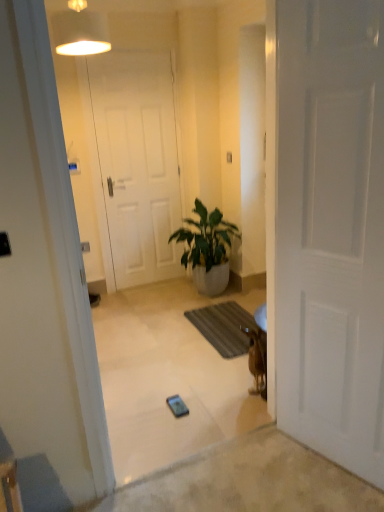
Where is `brown textured mat at lower center`? The width and height of the screenshot is (384, 512). brown textured mat at lower center is located at coordinates (224, 327).

This screenshot has height=512, width=384. Describe the element at coordinates (207, 249) in the screenshot. I see `green glossy plant at center` at that location.

Locate an element on the screen. metallic silver phone at center is located at coordinates (177, 406).

This screenshot has height=512, width=384. What are the coordinates of `brown furry dog at right` in the screenshot? It's located at (257, 359).

What do you see at coordinates (137, 163) in the screenshot? The height and width of the screenshot is (512, 384). I see `white matte door at center, which ranks as the first door in left-to-right order` at bounding box center [137, 163].

Where is `white matte door at center, placed as the second door when sorted from back to front`? white matte door at center, placed as the second door when sorted from back to front is located at coordinates (331, 229).

From a real-world perspective, is brown furry dog at right positioned under green glossy plant at center based on gravity?

Yes, from a real-world perspective, brown furry dog at right is below green glossy plant at center.

This screenshot has height=512, width=384. What are the coordinates of `animal in front of the green glossy plant at center` in the screenshot? It's located at (257, 359).

Which is further, (261, 366) or (229, 224)?

The point (229, 224) is behind.

Is green glossy plant at center at the back of brown furry dog at right?

No.

Considering the relative sizes of white fabric lampshade at upper center and metallic silver phone at center in the image provided, is white fabric lampshade at upper center thinner than metallic silver phone at center?

No.

How different are the orientations of white fabric lampshade at upper center and metallic silver phone at center in degrees?

The angular difference between white fabric lampshade at upper center and metallic silver phone at center is 2.1 degrees.

Where is `lamp that appears above the metallic silver phone at center (from the image's perspective)`? This screenshot has height=512, width=384. lamp that appears above the metallic silver phone at center (from the image's perspective) is located at coordinates (80, 31).

From their relative heights in the image, would you say white fabric lampshade at upper center is taller or shorter than metallic silver phone at center?

white fabric lampshade at upper center is taller than metallic silver phone at center.

Are green glossy plant at center and metallic silver phone at center far apart?

Yes, green glossy plant at center is far from metallic silver phone at center.

Is point (182, 240) more distant than point (184, 406)?

Yes, point (182, 240) is behind point (184, 406).

Which of these two, green glossy plant at center or metallic silver phone at center, is bigger?

green glossy plant at center is bigger.

Is green glossy plant at center to the left or to the right of metallic silver phone at center in the image?

In the image, green glossy plant at center appears on the right side of metallic silver phone at center.

From a real-world perspective, is metallic silver phone at center physically located above or below brown furry dog at right?

From a real-world perspective, metallic silver phone at center is physically below brown furry dog at right.

Is metallic silver phone at center far away from brown furry dog at right?

No, there isn't a large distance between metallic silver phone at center and brown furry dog at right.

Between point (171, 402) and point (260, 388), which one is positioned behind?

The point (260, 388) is more distant.

From the image's perspective, would you say metallic silver phone at center is positioned over brown furry dog at right?

No, from the image's perspective, metallic silver phone at center is not on top of brown furry dog at right.

Is white fabric lampshade at upper center facing away from brown furry dog at right?

No, white fabric lampshade at upper center is not facing the opposite direction of brown furry dog at right.

Is white fabric lampshade at upper center situated inside brown furry dog at right or outside?

white fabric lampshade at upper center is not inside brown furry dog at right, it's outside.

From the image's perspective, between white fabric lampshade at upper center and brown furry dog at right, who is located below?

brown furry dog at right.

Is point (82, 24) positioned before point (264, 351)?

Yes, point (82, 24) is in front of point (264, 351).

Can you confirm if white matte door at center, the 1th door positioned from the right, is positioned to the right of brown textured mat at lower center?

Yes.

What's the angular difference between white matte door at center, which is the 2th door in left-to-right order, and brown textured mat at lower center's facing directions?

The angle between the facing direction of white matte door at center, which is the 2th door in left-to-right order, and the facing direction of brown textured mat at lower center is 21.5 degrees.

Which is in front, point (304, 71) or point (220, 309)?

The point (304, 71) is closer to the camera.

From a real-world perspective, is white matte door at center, the 1th door positioned from the right, above or below brown textured mat at lower center?

white matte door at center, the 1th door positioned from the right, is situated higher than brown textured mat at lower center in the real world.

Considering the sizes of objects metallic silver phone at center and white fabric lampshade at upper center in the image provided, who is shorter, metallic silver phone at center or white fabric lampshade at upper center?

With less height is metallic silver phone at center.

Where is `lamp above the metallic silver phone at center (from the image's perspective)`? The width and height of the screenshot is (384, 512). lamp above the metallic silver phone at center (from the image's perspective) is located at coordinates (80, 31).

Between metallic silver phone at center and white fabric lampshade at upper center, which one has smaller size?

Smaller between the two is metallic silver phone at center.

Is metallic silver phone at center wider than white fabric lampshade at upper center?

Incorrect, the width of metallic silver phone at center does not surpass that of white fabric lampshade at upper center.

Identify the location of animal on the right side of green glossy plant at center. This screenshot has width=384, height=512. [x=257, y=359].

The height and width of the screenshot is (512, 384). Identify the location of lamp above the metallic silver phone at center (from the image's perspective). (80, 31).

Based on their spatial positions, is white matte door at center, which is the 2th door in left-to-right order, or brown furry dog at right further from white matte door at center, the second door positioned from the right?

white matte door at center, which is the 2th door in left-to-right order, is positioned further to the anchor white matte door at center, the second door positioned from the right.

Looking at the image, which one is located closer to white matte door at center, which is the 2th door in left-to-right order, white fabric lampshade at upper center or brown furry dog at right?

brown furry dog at right is closer to white matte door at center, which is the 2th door in left-to-right order.

Estimate the real-world distances between objects in this image. Which object is further from white matte door at center, which ranks as the first door in left-to-right order, green glossy plant at center or brown textured mat at lower center?

The object further to white matte door at center, which ranks as the first door in left-to-right order, is brown textured mat at lower center.

Estimate the real-world distances between objects in this image. Which object is closer to metallic silver phone at center, white matte door at center, which is the 2th door in left-to-right order, or brown furry dog at right?

brown furry dog at right is closer to metallic silver phone at center.

From the image, which object appears to be farther from metallic silver phone at center, white matte door at center, which is the 2th door in left-to-right order, or brown textured mat at lower center?

white matte door at center, which is the 2th door in left-to-right order, is positioned further to the anchor metallic silver phone at center.

Based on their spatial positions, is white fabric lampshade at upper center or green glossy plant at center closer to brown furry dog at right?

green glossy plant at center is positioned closer to the anchor brown furry dog at right.

From the image, which object appears to be farther from white matte door at center, the first door viewed from the back, green glossy plant at center or brown furry dog at right?

brown furry dog at right lies further to white matte door at center, the first door viewed from the back, than the other object.

When comparing their distances from green glossy plant at center, does white matte door at center, the second door positioned from the right, or brown furry dog at right seem closer?

white matte door at center, the second door positioned from the right, is positioned closer to the anchor green glossy plant at center.

At what (x,y) coordinates should I click in order to perform the action: click on lamp located between white matte door at center, which is the 2th door in left-to-right order, and white matte door at center, placed as the 2th door when sorted from front to back, in the depth direction. Please return your answer as a coordinate pair (x, y). This screenshot has height=512, width=384. Looking at the image, I should click on (80, 31).

You are a GUI agent. You are given a task and a screenshot of the screen. Output one action in this format:
    pyautogui.click(x=<x>, y=<y>)
    Task: Click on the animal positioned between white matte door at center, the 1th door positioned from the right, and brown textured mat at lower center from near to far
    Image resolution: width=384 pixels, height=512 pixels.
    Given the screenshot: What is the action you would take?
    pyautogui.click(x=257, y=359)

Image resolution: width=384 pixels, height=512 pixels. In order to click on mobile phone located between white matte door at center, placed as the second door when sorted from back to front, and white matte door at center, the second door positioned from the right, in the depth direction in this screenshot , I will do `click(177, 406)`.

Image resolution: width=384 pixels, height=512 pixels. In order to click on doormat between white fabric lampshade at upper center and brown furry dog at right in the vertical direction in this screenshot , I will do `click(224, 327)`.